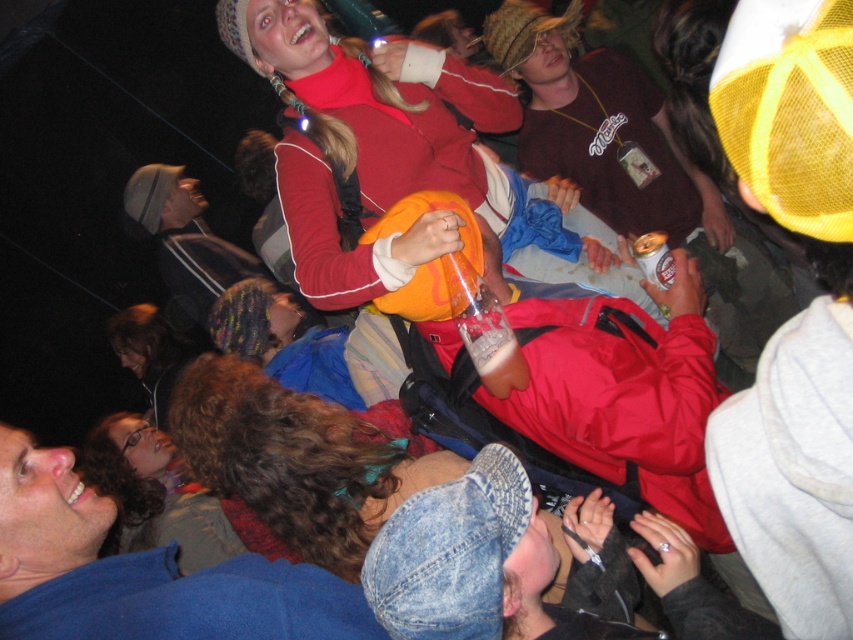
Question: Among these points, which one is nearest to the camera?

Choices:
 (A) (212, 298)
 (B) (664, 241)

Answer: (B)

Question: Among these points, which one is nearest to the camera?

Choices:
 (A) (646, 236)
 (B) (141, 204)
 (C) (322, 554)

Answer: (C)

Question: In this image, where is striped knit hat at upper center located relative to gold metallic can at center?

Choices:
 (A) below
 (B) above

Answer: (B)

Question: Is denim jacket at center to the left of striped knit hat at upper center from the viewer's perspective?

Choices:
 (A) yes
 (B) no

Answer: (B)

Question: Among these points, which one is farthest from the camera?

Choices:
 (A) (302, 396)
 (B) (643, 243)

Answer: (B)

Question: Observing the image, what is the correct spatial positioning of matte brown shirt at center in reference to striped knit hat at upper center?

Choices:
 (A) above
 (B) below

Answer: (A)